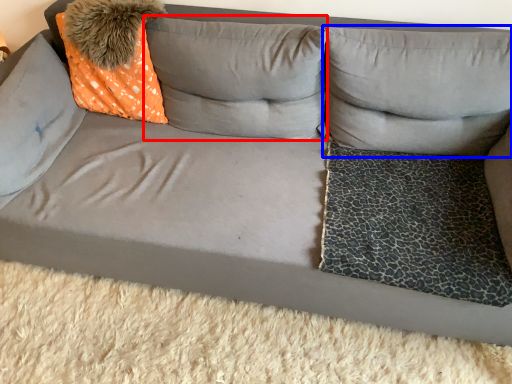
Question: Which object appears closest to the camera in this image, pillow (highlighted by a red box) or pillow (highlighted by a blue box)?

Choices:
 (A) pillow
 (B) pillow

Answer: (B)